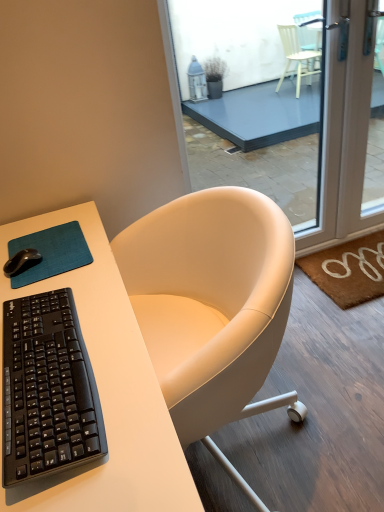
Question: Should I look upward or downward to see black matte mouse at upper left?

Choices:
 (A) down
 (B) up

Answer: (A)

Question: From the image's perspective, is black matte mouse at upper left below teal fabric mousepad at lower left?

Choices:
 (A) no
 (B) yes

Answer: (B)

Question: Could you tell me if black matte mouse at upper left is turned towards teal fabric mousepad at lower left?

Choices:
 (A) no
 (B) yes

Answer: (B)

Question: Is black matte mouse at upper left with teal fabric mousepad at lower left?

Choices:
 (A) no
 (B) yes

Answer: (B)

Question: Is black matte mouse at upper left far from teal fabric mousepad at lower left?

Choices:
 (A) no
 (B) yes

Answer: (A)

Question: Is the position of black matte mouse at upper left less distant than that of teal fabric mousepad at lower left?

Choices:
 (A) no
 (B) yes

Answer: (A)

Question: Is black matte mouse at upper left oriented away from teal fabric mousepad at lower left?

Choices:
 (A) no
 (B) yes

Answer: (A)

Question: Is black matte mouse at upper left oriented away from white matte desk at center?

Choices:
 (A) no
 (B) yes

Answer: (B)

Question: Does black matte mouse at upper left have a greater height compared to white matte desk at center?

Choices:
 (A) no
 (B) yes

Answer: (A)

Question: From a real-world perspective, is black matte mouse at upper left under white matte desk at center?

Choices:
 (A) yes
 (B) no

Answer: (B)

Question: Does black matte mouse at upper left have a lesser height compared to white matte desk at center?

Choices:
 (A) yes
 (B) no

Answer: (A)

Question: Is black matte mouse at upper left smaller than white matte desk at center?

Choices:
 (A) no
 (B) yes

Answer: (B)

Question: Does black matte mouse at upper left have a greater width compared to white matte desk at center?

Choices:
 (A) no
 (B) yes

Answer: (A)

Question: Could you tell me if black matte mouse at upper left is turned towards brown coir doormat at lower right?

Choices:
 (A) no
 (B) yes

Answer: (A)